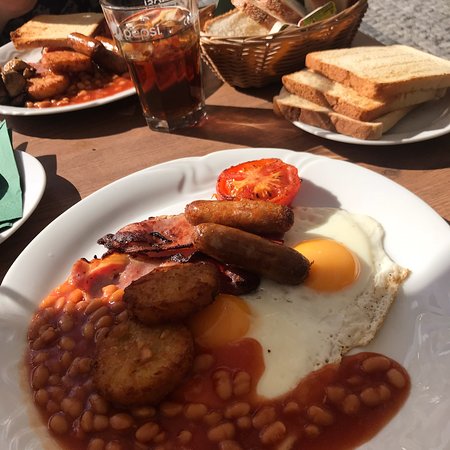
The width and height of the screenshot is (450, 450). What are the coordinates of `napkin` in the screenshot? It's located at (13, 208).